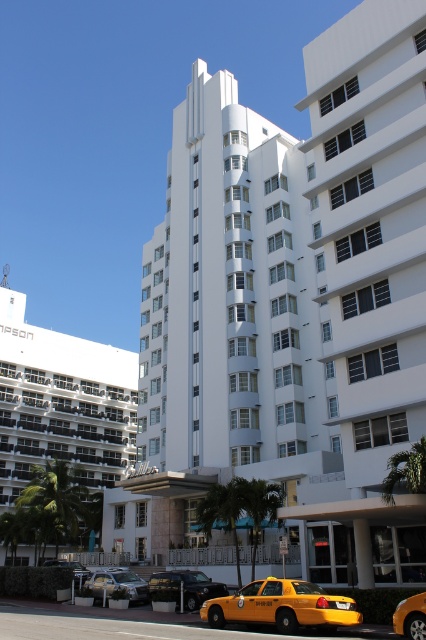
Between point (403, 604) and point (77, 579), which one is positioned behind?

The point (77, 579) is behind.

Identify the location of yellow matte taxi at center. This screenshot has width=426, height=640. (411, 616).

Is point (417, 595) closer to viewer compared to point (78, 580)?

Yes, point (417, 595) is closer to viewer.

Find the location of `yellow matte taxi at center`. yellow matte taxi at center is located at coordinates (411, 616).

Locate an element on the screen. The width and height of the screenshot is (426, 640). white matte building at left is located at coordinates (62, 403).

Does point (88, 436) come in front of point (63, 564)?

No, it is behind (63, 564).

This screenshot has height=640, width=426. I want to click on white matte building at left, so click(62, 403).

Based on the photo, is white smooth building at center shorter than yellow matte taxi at lower center?

No.

Does point (353, 12) come behind point (244, 620)?

That is True.

Who is more distant from viewer, (377, 132) or (350, 596)?

Positioned behind is point (377, 132).

Where is `white smooth building at center`? This screenshot has height=640, width=426. white smooth building at center is located at coordinates (290, 310).